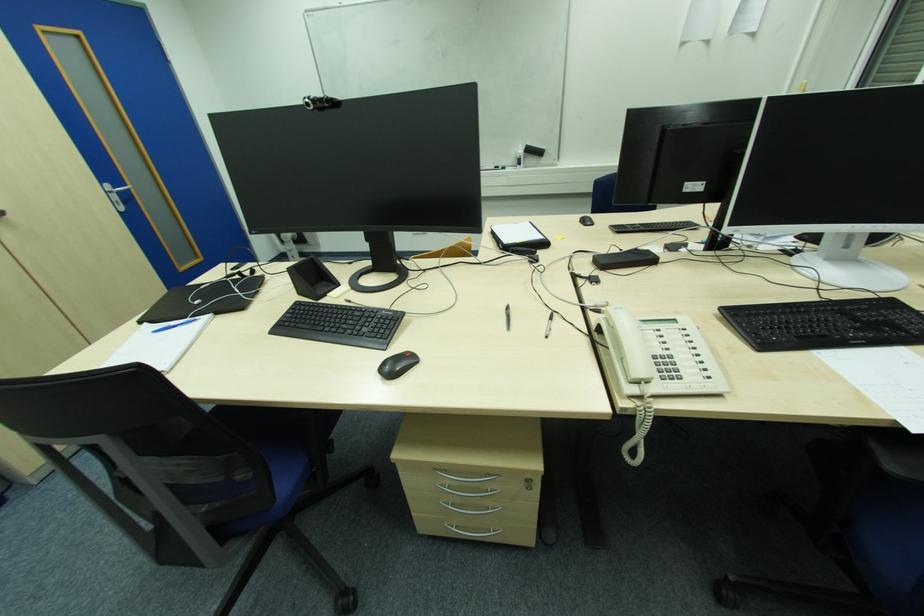
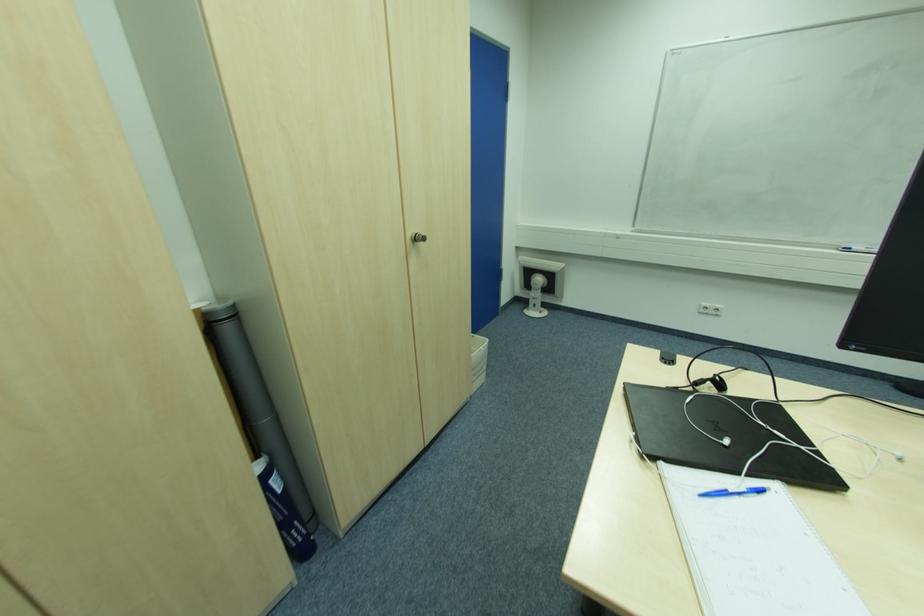
Locate, in the second image, the point that corresponds to (292,253) in the first image.

(536, 300)